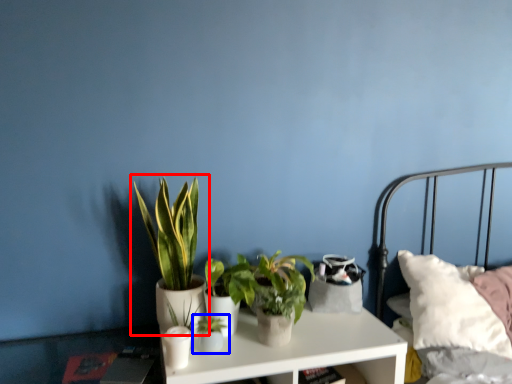
Question: Which object is closer to the camera taking this photo, houseplant (highlighted by a red box) or houseplant (highlighted by a blue box)?

Choices:
 (A) houseplant
 (B) houseplant

Answer: (A)